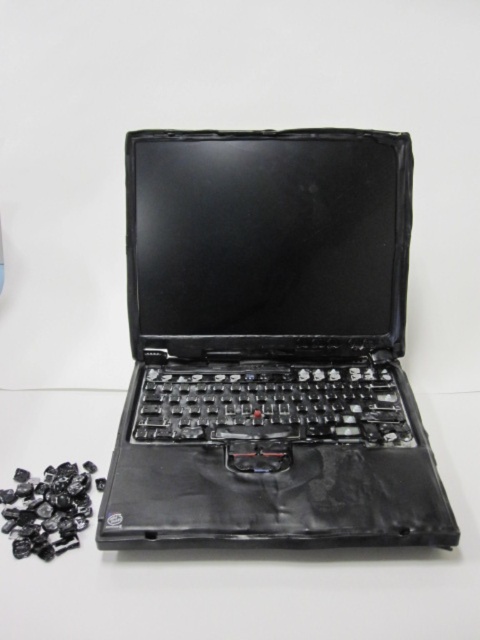
You are a technician examining the laptop and the scattered keys. You notice two points marked on your screen at coordinates point [355,195] and point [430,394]. Which point is closer to you?

Point [355,195] is in front of point [430,394], so it is closer to you.

You are setting up a desk for a tech enthusiast who wants to arrange their matte black laptop at center and black plastic keyboard at lower center. They want to stack items vertically. Which item should be placed at the bottom to ensure stability?

The black plastic keyboard at lower center should be placed at the bottom since it is shorter than the matte black laptop at center, providing a stable base for the stack.